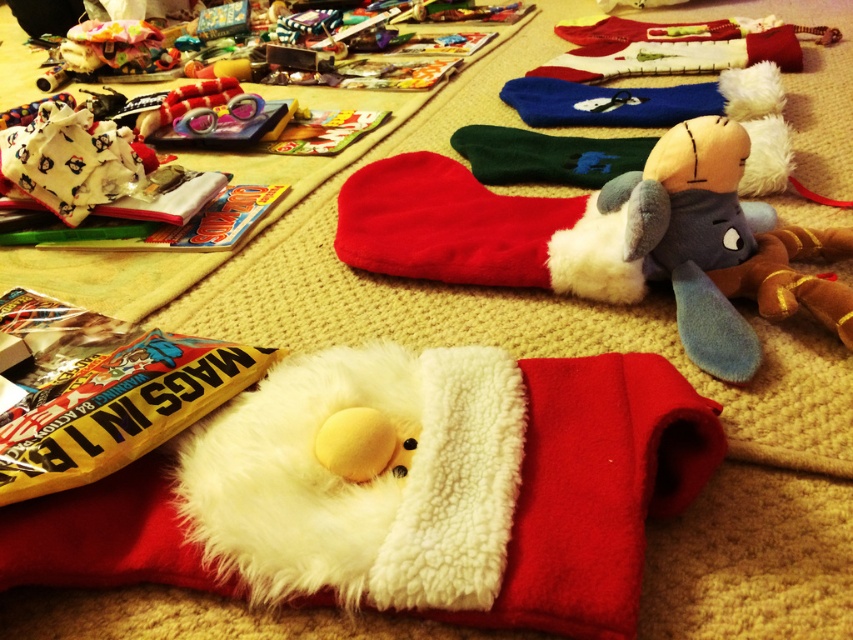
Can you confirm if blue plush toy at upper right is thinner than red plush sock at center?

Correct, blue plush toy at upper right's width is less than red plush sock at center's.

Describe the element at coordinates (721, 244) in the screenshot. I see `blue plush toy at upper right` at that location.

This screenshot has height=640, width=853. Identify the location of blue plush toy at upper right. 721,244.